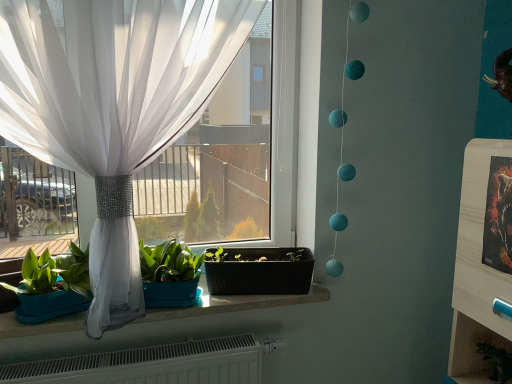
Question: Considering the relative positions of wooden shelf at lower right and black plastic flowerpot at center in the image provided, is wooden shelf at lower right to the left or to the right of black plastic flowerpot at center?

Choices:
 (A) left
 (B) right

Answer: (B)

Question: Based on their sizes in the image, would you say wooden shelf at lower right is bigger or smaller than black plastic flowerpot at center?

Choices:
 (A) big
 (B) small

Answer: (B)

Question: Estimate the real-world distances between objects in this image. Which object is closer to the wooden shelf at lower right?

Choices:
 (A) white sheer curtain at left
 (B) matte white stone window sill at center
 (C) metallic gold picture frame at right
 (D) black plastic flowerpot at center

Answer: (C)

Question: Based on their relative distances, which object is nearer to the metallic gold picture frame at right?

Choices:
 (A) matte white stone window sill at center
 (B) white sheer curtain at left
 (C) black plastic flowerpot at center
 (D) wooden shelf at lower right

Answer: (D)